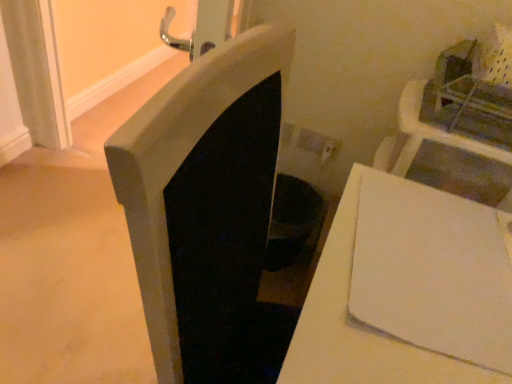
Question: Does black matte fireplace at center have a smaller size compared to white matte table at lower right?

Choices:
 (A) yes
 (B) no

Answer: (A)

Question: Does black matte fireplace at center have a larger size compared to white matte table at lower right?

Choices:
 (A) yes
 (B) no

Answer: (B)

Question: Is black matte fireplace at center wider than white matte table at lower right?

Choices:
 (A) yes
 (B) no

Answer: (B)

Question: Is black matte fireplace at center outside white matte table at lower right?

Choices:
 (A) yes
 (B) no

Answer: (A)

Question: Is black matte fireplace at center not near white matte table at lower right?

Choices:
 (A) yes
 (B) no

Answer: (B)

Question: Considering the relative positions of black matte fireplace at center and white matte table at lower right in the image provided, is black matte fireplace at center to the right of white matte table at lower right from the viewer's perspective?

Choices:
 (A) no
 (B) yes

Answer: (A)

Question: From the image's perspective, would you say white matte table at lower right is positioned over black matte fireplace at center?

Choices:
 (A) yes
 (B) no

Answer: (B)

Question: Is white matte table at lower right smaller than black matte fireplace at center?

Choices:
 (A) no
 (B) yes

Answer: (A)

Question: Is white matte table at lower right aimed at black matte fireplace at center?

Choices:
 (A) yes
 (B) no

Answer: (A)

Question: Does white matte table at lower right have a greater height compared to black matte fireplace at center?

Choices:
 (A) no
 (B) yes

Answer: (A)

Question: Does white matte table at lower right come behind black matte fireplace at center?

Choices:
 (A) no
 (B) yes

Answer: (A)

Question: Can you confirm if white matte table at lower right is thinner than black matte fireplace at center?

Choices:
 (A) no
 (B) yes

Answer: (A)

Question: Considering their positions, is black matte fireplace at center located in front of or behind white matte table at lower right?

Choices:
 (A) front
 (B) behind

Answer: (B)